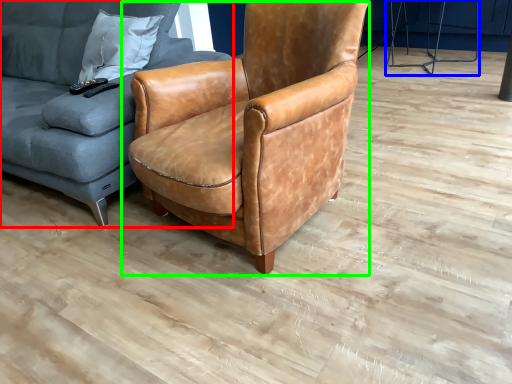
Question: Which is nearer to the studio couch (highlighted by a red box)? half (highlighted by a blue box) or chair (highlighted by a green box).

Choices:
 (A) half
 (B) chair

Answer: (B)